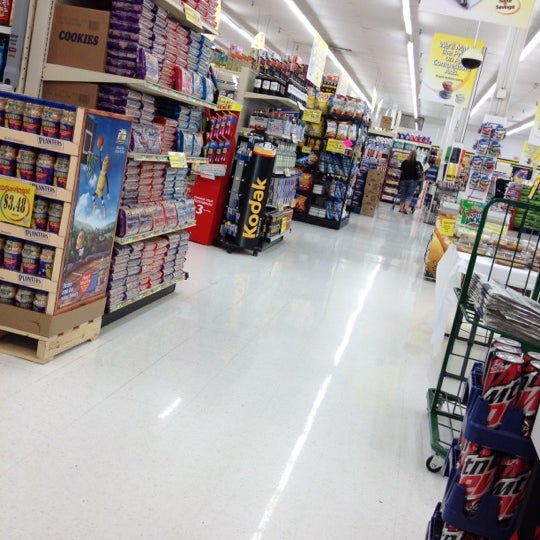
Find the location of a particular element. ceiling is located at coordinates (361, 37), (401, 85).